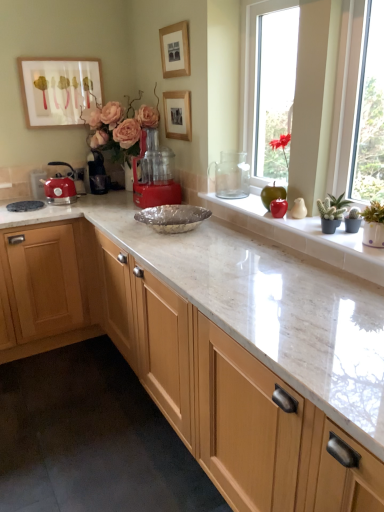
Question: From a real-world perspective, does green succulent at right, placed as the second plant when sorted from left to right, sit lower than matte red kettle at left?

Choices:
 (A) no
 (B) yes

Answer: (A)

Question: Can you confirm if green succulent at right, placed as the second plant when sorted from left to right, is wider than matte red kettle at left?

Choices:
 (A) yes
 (B) no

Answer: (B)

Question: From the image's perspective, is green succulent at right, positioned as the 1th plant in bottom-to-top order, on top of matte red kettle at left?

Choices:
 (A) yes
 (B) no

Answer: (B)

Question: Is green succulent at right, positioned as the 1th plant in bottom-to-top order, bigger than matte red kettle at left?

Choices:
 (A) no
 (B) yes

Answer: (A)

Question: From the image's perspective, is green succulent at right, placed as the second plant when sorted from left to right, beneath matte red kettle at left?

Choices:
 (A) no
 (B) yes

Answer: (B)

Question: Is red plastic food processor at center, which is the second coffee machine from back to front, bigger or smaller than green succulent at right, positioned as the 1th plant in right-to-left order?

Choices:
 (A) big
 (B) small

Answer: (A)

Question: Considering the positions of point (170, 184) and point (329, 216), is point (170, 184) closer or farther from the camera than point (329, 216)?

Choices:
 (A) farther
 (B) closer

Answer: (A)

Question: In terms of width, does red plastic food processor at center, which is the first coffee machine in front-to-back order, look wider or thinner when compared to green succulent at right, the second plant in the top-to-bottom sequence?

Choices:
 (A) thin
 (B) wide

Answer: (B)

Question: Relative to green succulent at right, placed as the second plant when sorted from left to right, is red plastic food processor at center, the 1th coffee machine viewed from the right, in front or behind?

Choices:
 (A) behind
 (B) front

Answer: (A)

Question: Would you say black plastic coffee machine at center, arranged as the 1th coffee machine when viewed from the back, is to the left or to the right of wooden picture frame at upper center, positioned as the third picture frame in left-to-right order, in the picture?

Choices:
 (A) left
 (B) right

Answer: (A)

Question: From their relative heights in the image, would you say black plastic coffee machine at center, the 2th coffee machine when ordered from right to left, is taller or shorter than wooden picture frame at upper center, the first picture frame in the right-to-left sequence?

Choices:
 (A) short
 (B) tall

Answer: (B)

Question: Considering the positions of black plastic coffee machine at center, the first coffee machine from the left, and wooden picture frame at upper center, the first picture frame in the right-to-left sequence, in the image, is black plastic coffee machine at center, the first coffee machine from the left, bigger or smaller than wooden picture frame at upper center, the first picture frame in the right-to-left sequence,?

Choices:
 (A) small
 (B) big

Answer: (B)

Question: In terms of width, does black plastic coffee machine at center, arranged as the 1th coffee machine when viewed from the back, look wider or thinner when compared to wooden picture frame at upper center, the first picture frame in the right-to-left sequence?

Choices:
 (A) thin
 (B) wide

Answer: (B)

Question: Is red matte flower at upper right, which appears as the first plant when viewed from the back, in front of or behind red plastic food processor at center, the 1th coffee machine viewed from the right, in the image?

Choices:
 (A) front
 (B) behind

Answer: (A)

Question: From a real-world perspective, is red matte flower at upper right, which ranks as the second plant in right-to-left order, positioned above or below red plastic food processor at center, the 1th coffee machine viewed from the right?

Choices:
 (A) below
 (B) above

Answer: (B)